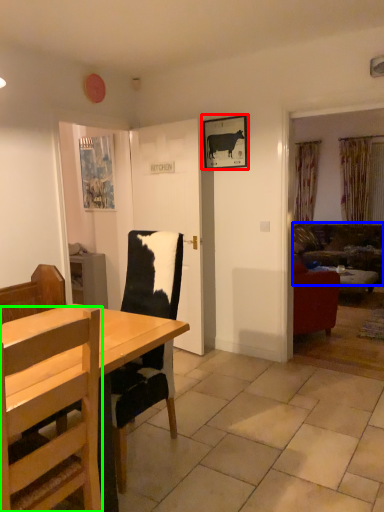
Question: Which object is positioned farthest from picture frame (highlighted by a red box)? Select from studio couch (highlighted by a blue box) and chair (highlighted by a green box).

Choices:
 (A) studio couch
 (B) chair

Answer: (A)